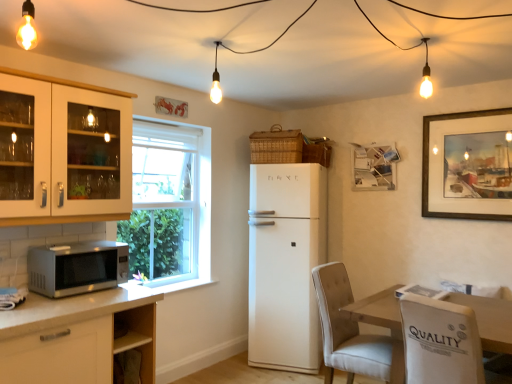
Question: Can you see white matte refrigerator at center touching white glass cabinet at left?

Choices:
 (A) no
 (B) yes

Answer: (A)

Question: Is the position of white matte refrigerator at center less distant than that of white glass cabinet at left?

Choices:
 (A) yes
 (B) no

Answer: (B)

Question: Is white matte refrigerator at center at the right side of white glass cabinet at left?

Choices:
 (A) no
 (B) yes

Answer: (B)

Question: Does white matte refrigerator at center appear on the left side of white glass cabinet at left?

Choices:
 (A) yes
 (B) no

Answer: (B)

Question: From the image's perspective, is white matte refrigerator at center on top of white glass cabinet at left?

Choices:
 (A) no
 (B) yes

Answer: (A)

Question: From the image's perspective, is white matte refrigerator at center beneath white glass cabinet at left?

Choices:
 (A) yes
 (B) no

Answer: (A)

Question: Can you confirm if woven brown basket at upper center, placed as the 2th basket when sorted from right to left, is wider than white fabric chair at lower right?

Choices:
 (A) no
 (B) yes

Answer: (A)

Question: Does woven brown basket at upper center, placed as the 2th basket when sorted from right to left, appear on the right side of white fabric chair at lower right?

Choices:
 (A) yes
 (B) no

Answer: (B)

Question: Is woven brown basket at upper center, which ranks as the 1th basket in left-to-right order, further to the viewer compared to white fabric chair at lower right?

Choices:
 (A) yes
 (B) no

Answer: (A)

Question: Considering the relative sizes of woven brown basket at upper center, placed as the 2th basket when sorted from right to left, and white fabric chair at lower right in the image provided, is woven brown basket at upper center, placed as the 2th basket when sorted from right to left, thinner than white fabric chair at lower right?

Choices:
 (A) yes
 (B) no

Answer: (A)

Question: Is woven brown basket at upper center, which ranks as the 1th basket in left-to-right order, at the left side of white fabric chair at lower right?

Choices:
 (A) yes
 (B) no

Answer: (A)

Question: From the image's perspective, is woven brown basket at upper center, placed as the 2th basket when sorted from right to left, located beneath white fabric chair at lower right?

Choices:
 (A) no
 (B) yes

Answer: (A)

Question: Considering the relative sizes of white fabric chair at lower right and white glass cabinet at left in the image provided, is white fabric chair at lower right bigger than white glass cabinet at left?

Choices:
 (A) yes
 (B) no

Answer: (A)